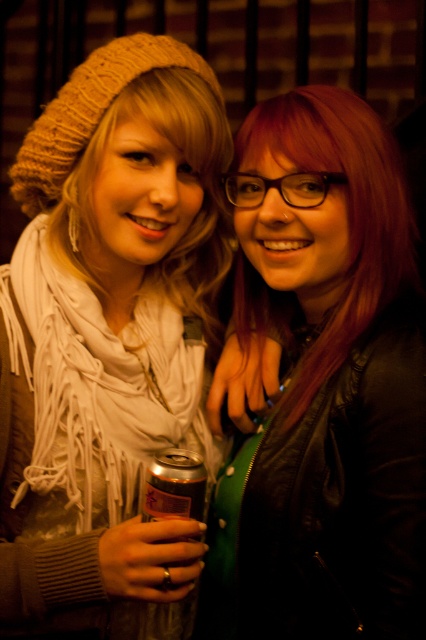
Question: Does knitted beige beanie at upper left appear on the right side of shiny black leather jacket at center?

Choices:
 (A) yes
 (B) no

Answer: (B)

Question: Considering the relative positions of knitted beige beanie at upper left and metallic can at center in the image provided, where is knitted beige beanie at upper left located with respect to metallic can at center?

Choices:
 (A) above
 (B) below

Answer: (A)

Question: Which object is positioned farthest from the knitted beige beanie at upper left?

Choices:
 (A) shiny black leather jacket at center
 (B) metallic can at center

Answer: (B)

Question: Which object is farther from the camera taking this photo?

Choices:
 (A) metallic can at center
 (B) knitted beige beanie at upper left
 (C) shiny black leather jacket at center

Answer: (A)

Question: Can you confirm if shiny black leather jacket at center is smaller than metallic can at center?

Choices:
 (A) no
 (B) yes

Answer: (A)

Question: Which point is farther from the camera taking this photo?

Choices:
 (A) (299, 518)
 (B) (158, 636)
 (C) (9, 353)

Answer: (B)